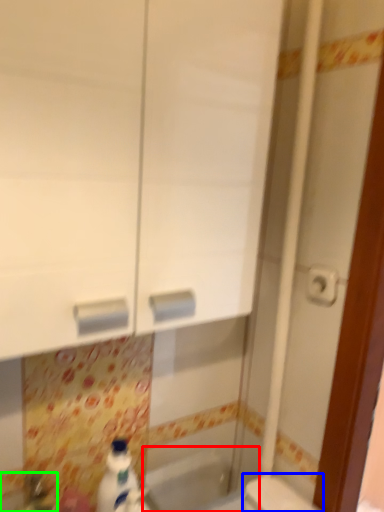
Question: Which object is the farthest from bath (highlighted by a red box)? Choose among these: toilet (highlighted by a blue box) or sink (highlighted by a green box).

Choices:
 (A) toilet
 (B) sink

Answer: (B)